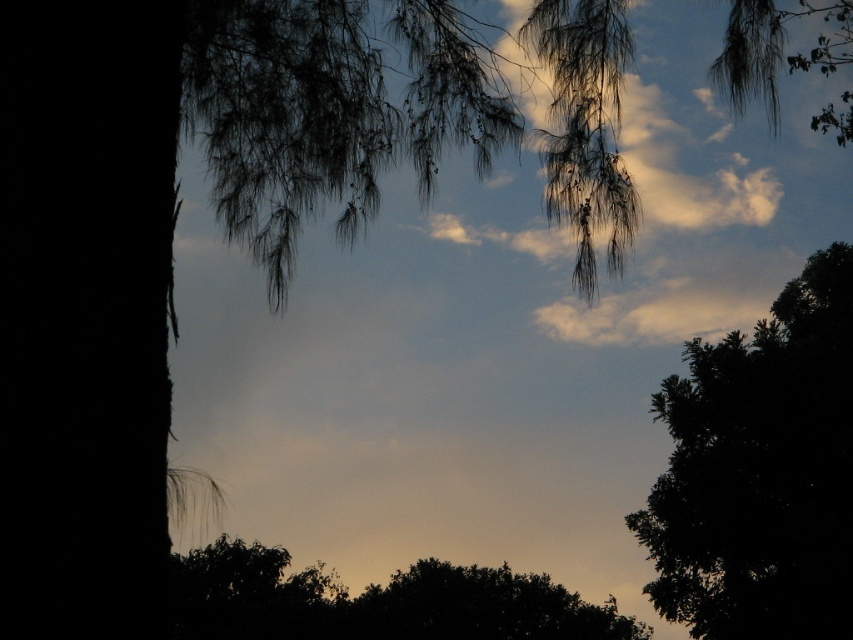
Does dark green leafy tree at right have a smaller size compared to dark green leafy tree at center?

No.

Measure the distance between dark green leafy tree at right and dark green leafy tree at center.

dark green leafy tree at right is 7.28 meters from dark green leafy tree at center.

Is point (724, 397) farther from camera compared to point (299, 598)?

No, (724, 397) is closer to viewer.

The image size is (853, 640). Find the location of `dark green leafy tree at right`. dark green leafy tree at right is located at coordinates (759, 472).